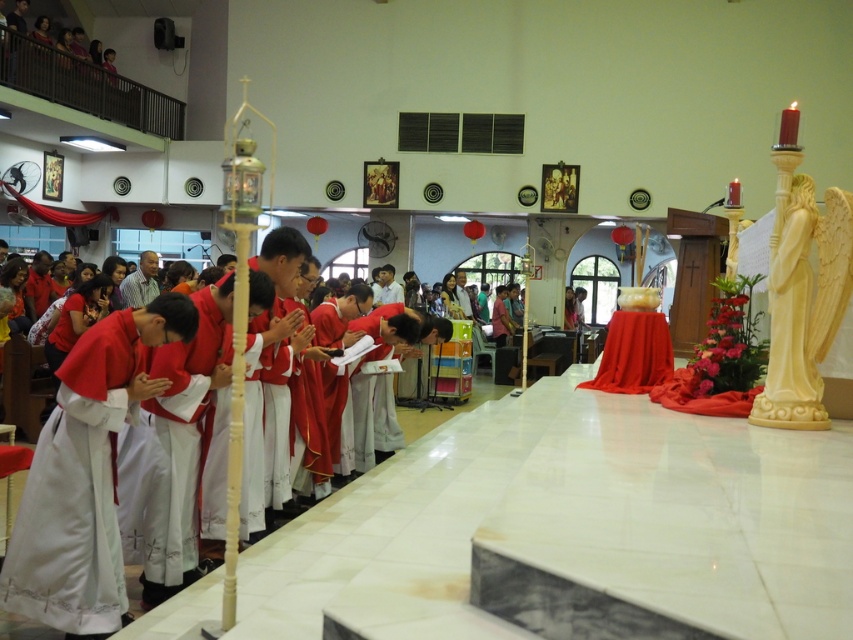
Question: Which point is closer to the camera?

Choices:
 (A) matte red robe at center
 (B) white satin robe at lower left

Answer: (B)

Question: Among these points, which one is nearest to the camera?

Choices:
 (A) (474, 397)
 (B) (9, 550)

Answer: (B)

Question: Is white satin robe at lower left closer to camera compared to matte red robe at center?

Choices:
 (A) no
 (B) yes

Answer: (B)

Question: Does white satin robe at lower left have a larger size compared to matte red robe at center?

Choices:
 (A) yes
 (B) no

Answer: (B)

Question: Which of the following is the closest to the observer?

Choices:
 (A) white satin robe at lower left
 (B) matte red robe at center

Answer: (A)

Question: Is white satin robe at lower left above matte red robe at center?

Choices:
 (A) yes
 (B) no

Answer: (B)